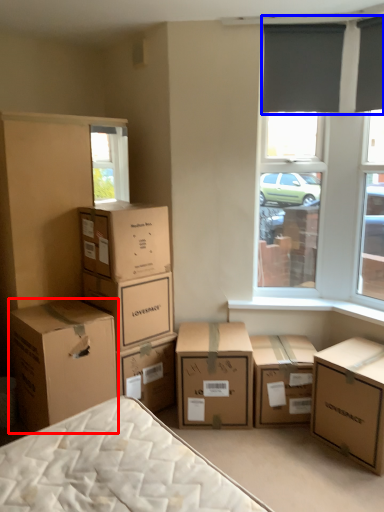
Question: Which object appears farthest to the camera in this image, box (highlighted by a red box) or curtain (highlighted by a blue box)?

Choices:
 (A) box
 (B) curtain

Answer: (B)